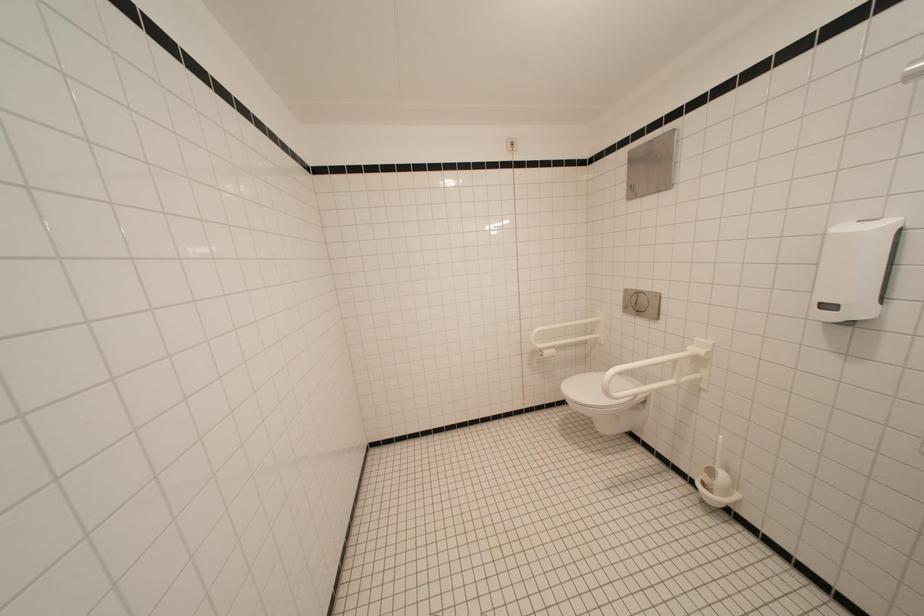
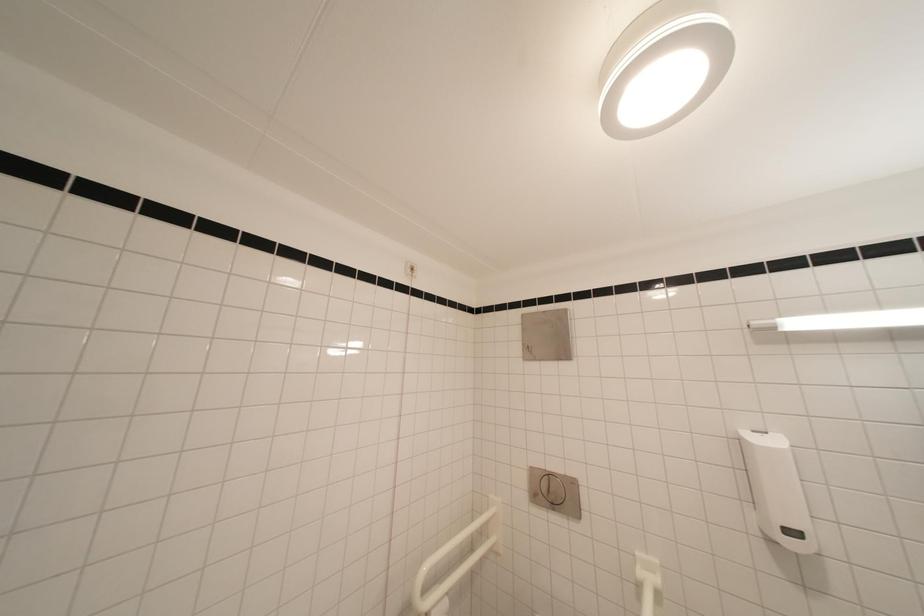
First-person continuous shooting, in which direction is the camera rotating?

The camera's rotation is toward right-up.